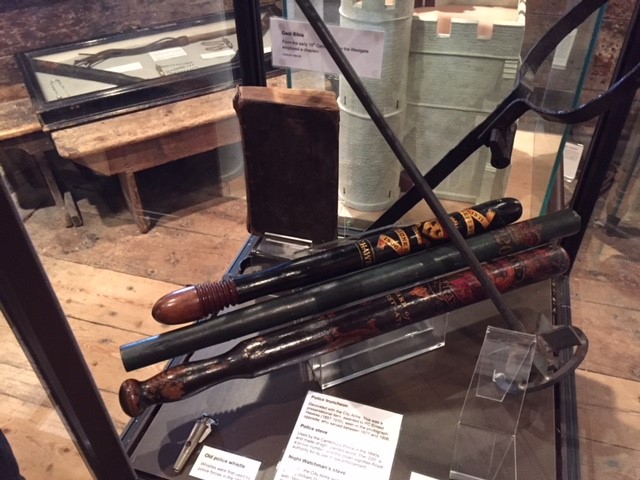
The image size is (640, 480). I want to click on white card on vertical surface, so click(x=365, y=62).